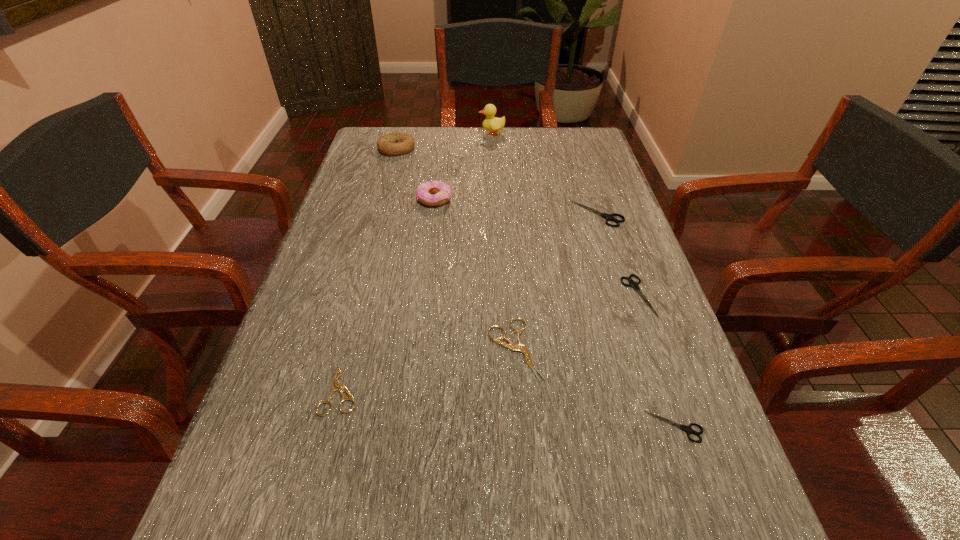
The width and height of the screenshot is (960, 540). In the image, there is a desktop. What are the coordinates of `vacant space at the far edge` in the screenshot? It's located at (514, 129).

Identify the location of free space at the left edge of the desktop. Image resolution: width=960 pixels, height=540 pixels. [x=383, y=165].

This screenshot has height=540, width=960. In order to click on free space at the right edge in this screenshot , I will do `click(651, 313)`.

Locate an element on the screen. vacant area between the third object from left to right and the leftmost shears is located at coordinates (388, 292).

Locate an element on the screen. Image resolution: width=960 pixels, height=540 pixels. free space between the farthest object and the nearest black shears is located at coordinates (584, 280).

Locate an element on the screen. The image size is (960, 540). vacant space that is in between the biggest black shears and the brown bagel is located at coordinates (497, 181).

The width and height of the screenshot is (960, 540). Identify the location of free space between the yellow duckling and the bigger beige shears. (503, 241).

The image size is (960, 540). I want to click on free space between the tallest object and the left beige shears, so click(x=417, y=259).

The image size is (960, 540). I want to click on blank region between the pink doughnut and the second shears from left to right, so click(474, 274).

This screenshot has width=960, height=540. I want to click on empty location between the smallest black shears and the bagel, so click(536, 287).